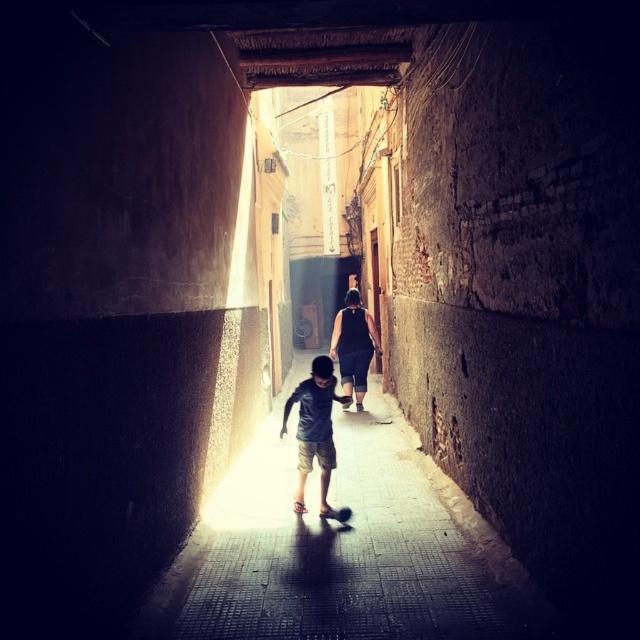
Question: Which object is positioned farthest from the black matte dress at center?

Choices:
 (A) dark gray cotton shirt at center
 (B) smooth concrete sidewalk at center

Answer: (B)

Question: Considering the real-world distances, which object is closest to the black matte dress at center?

Choices:
 (A) dark gray cotton shirt at center
 (B) smooth concrete sidewalk at center

Answer: (A)

Question: Which object is farther from the camera taking this photo?

Choices:
 (A) black matte dress at center
 (B) dark gray cotton shirt at center
 (C) smooth concrete sidewalk at center

Answer: (A)

Question: Is dark gray cotton shirt at center to the right of black matte dress at center from the viewer's perspective?

Choices:
 (A) no
 (B) yes

Answer: (A)

Question: Where is smooth concrete sidewalk at center located in relation to dark gray cotton shirt at center in the image?

Choices:
 (A) above
 (B) below

Answer: (B)

Question: Does smooth concrete sidewalk at center have a larger size compared to black matte dress at center?

Choices:
 (A) no
 (B) yes

Answer: (A)